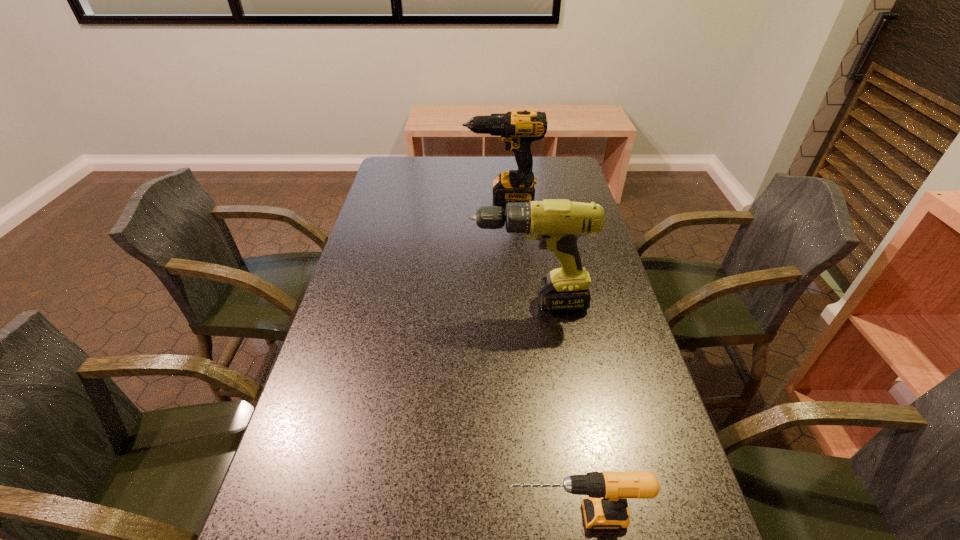
This screenshot has width=960, height=540. Identify the location of free spot located 0.110m on the handle side of the shortest object. (444, 516).

Locate an element on the screen. The height and width of the screenshot is (540, 960). vacant space situated on the handle side of the shortest object is located at coordinates (291, 516).

I want to click on blank space located on the handle side of the shortest object, so click(x=473, y=516).

This screenshot has width=960, height=540. In the image, there is a desktop. What are the coordinates of `free space at the far edge` in the screenshot? It's located at (480, 161).

Image resolution: width=960 pixels, height=540 pixels. In the image, there is a desktop. Identify the location of free space at the left edge. (348, 333).

In the image, there is a desktop. In order to click on vacant space at the right edge in this screenshot , I will do `click(569, 316)`.

Where is `free space at the far left corner of the desktop`? Image resolution: width=960 pixels, height=540 pixels. free space at the far left corner of the desktop is located at coordinates (406, 173).

The image size is (960, 540). What are the coordinates of `vacant position at the far right corner of the desktop` in the screenshot? It's located at (540, 172).

Where is `free space between the nearest drill and the second farthest object`? The height and width of the screenshot is (540, 960). free space between the nearest drill and the second farthest object is located at coordinates (552, 409).

Locate an element on the screen. The image size is (960, 540). empty space between the farthest object and the nearest drill is located at coordinates pos(539,357).